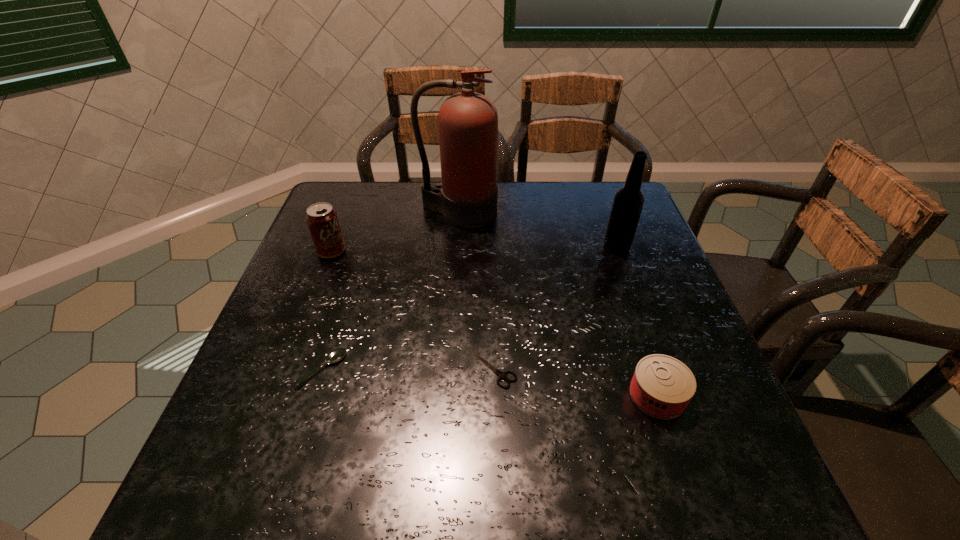
This screenshot has width=960, height=540. In the image, there is a desktop. Find the location of `free space at the left edge`. free space at the left edge is located at coordinates (232, 442).

Find the location of a particular element. vacant space at the right edge of the desktop is located at coordinates 667,282.

Locate an element on the screen. The width and height of the screenshot is (960, 540). blank space at the far left corner is located at coordinates (346, 183).

Locate an element on the screen. Image resolution: width=960 pixels, height=540 pixels. vacant space at the near left corner of the desktop is located at coordinates (x=273, y=473).

Locate an element on the screen. Image resolution: width=960 pixels, height=540 pixels. vacant region at the far right corner of the desktop is located at coordinates (594, 224).

The image size is (960, 540). In the image, there is a desktop. Find the location of `blank space at the near right corner`. blank space at the near right corner is located at coordinates (691, 455).

Identify the location of free space between the soupspoon and the can. (490, 382).

Identify the location of free spot between the fifth tallest object and the third tallest object. (327, 310).

I want to click on free space between the fourth tallest object and the soda can, so click(494, 323).

I want to click on free spot between the beer bottle and the fourth tallest object, so click(637, 321).